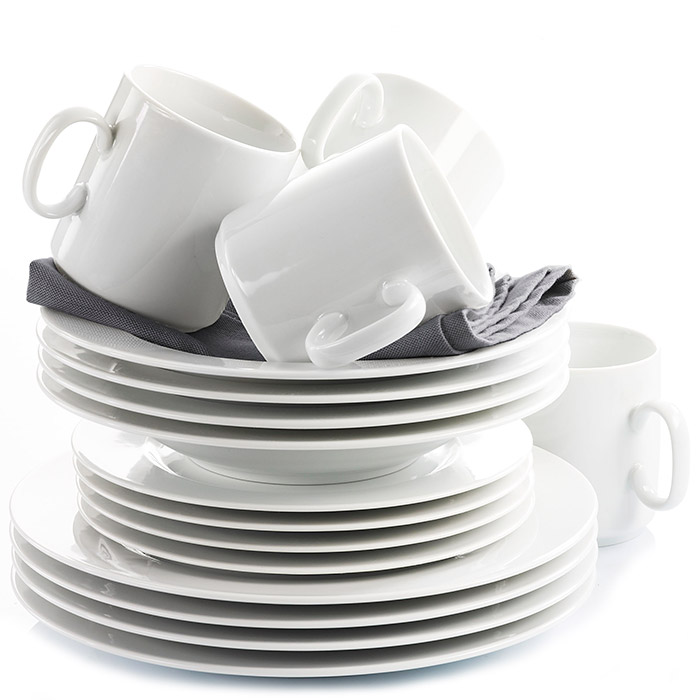
This screenshot has height=700, width=700. Find the location of `white bowls`. white bowls is located at coordinates point(309,440), point(316,420), point(322,392), point(323,374).